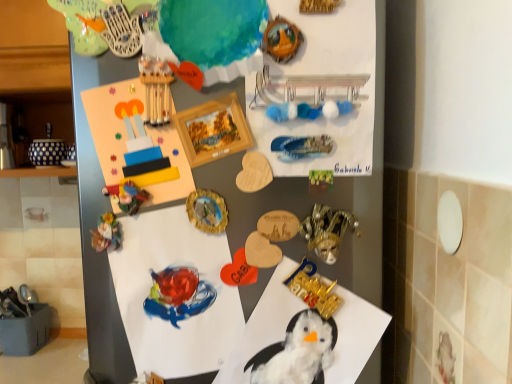
You are a GUI agent. You are given a task and a screenshot of the screen. Output one action in this format:
    pyautogui.click(x=<x>, y=<y>)
    Task: Click on the white matte paper at upper center, which is the 1th paper in top-to-bottom order
    Image resolution: width=512 pixels, height=384 pixels.
    Given the screenshot: What is the action you would take?
    pyautogui.click(x=319, y=92)

What is the approximate width of white fluffy paper at center, which appears as the third paper when viewed from the top?

2.17 inches.

Describe the element at coordinates (106, 233) in the screenshot. I see `porcelain figurine at lower left, which is counted as the second art, starting from the top` at that location.

Image resolution: width=512 pixels, height=384 pixels. What do you see at coordinates (313, 289) in the screenshot?
I see `gold metallic mask at center, which ranks as the first toy in bottom-to-top order` at bounding box center [313, 289].

What are the coordinates of `white matte paper at upper center, which is the 1th paper in top-to-bottom order` in the screenshot? It's located at (319, 92).

Does white fluffy paper at center, which appears as the first paper when ordered from the bottom, have a greater height compared to watercolor paper at center, the 2th paper viewed from the top?

Correct, white fluffy paper at center, which appears as the first paper when ordered from the bottom, is much taller as watercolor paper at center, the 2th paper viewed from the top.

In order to click on the 1st paper to the right of the watercolor paper at center, placed as the second paper when sorted from bottom to top, starting your count from the anchor in this screenshot , I will do [265, 327].

Looking at this image, is white fluffy paper at center, which appears as the first paper when ordered from the bottom, in front of or behind watercolor paper at center, the 2th paper viewed from the top, in the image?

white fluffy paper at center, which appears as the first paper when ordered from the bottom, is positioned closer to the viewer than watercolor paper at center, the 2th paper viewed from the top.

Does gold metallic mask at center, which ranks as the first toy in bottom-to-top order, have a smaller size compared to wooden picture frame at center?

Correct, gold metallic mask at center, which ranks as the first toy in bottom-to-top order, occupies less space than wooden picture frame at center.

Considering the relative positions of gold metallic mask at center, placed as the 2th toy when sorted from top to bottom, and wooden picture frame at center in the image provided, is gold metallic mask at center, placed as the 2th toy when sorted from top to bottom, to the right of wooden picture frame at center from the viewer's perspective?

Yes.

Is gold metallic mask at center, which ranks as the first toy in bottom-to-top order, closer to camera compared to wooden picture frame at center?

No, gold metallic mask at center, which ranks as the first toy in bottom-to-top order, is further to the viewer.

Is gold metallic mask at center, placed as the 2th toy when sorted from top to bottom, positioned with its back to wooden picture frame at center?

gold metallic mask at center, placed as the 2th toy when sorted from top to bottom, is not turned away from wooden picture frame at center.

Is wooden picture frame at center surrounded by watercolor paper at center, the 2th paper viewed from the top?

No, wooden picture frame at center is located outside of watercolor paper at center, the 2th paper viewed from the top.

At what (x,y) coordinates should I click in order to perform the action: click on paper on the left of wooden picture frame at center. Please return your answer as a coordinate pair (x, y). The height and width of the screenshot is (384, 512). Looking at the image, I should click on (170, 304).

Can you confirm if watercolor paper at center, placed as the second paper when sorted from bottom to top, is shorter than wooden picture frame at center?

In fact, watercolor paper at center, placed as the second paper when sorted from bottom to top, may be taller than wooden picture frame at center.

From the image's perspective, does gold metallic mask at center, placed as the 2th toy when sorted from top to bottom, appear lower than porcelain figurine at lower left, which is counted as the second art, starting from the top?

Yes, from the image's perspective, gold metallic mask at center, placed as the 2th toy when sorted from top to bottom, is beneath porcelain figurine at lower left, which is counted as the second art, starting from the top.

Is gold metallic mask at center, placed as the 2th toy when sorted from top to bottom, not inside porcelain figurine at lower left, arranged as the first art when ordered from the bottom?

Indeed, gold metallic mask at center, placed as the 2th toy when sorted from top to bottom, is completely outside porcelain figurine at lower left, arranged as the first art when ordered from the bottom.

Considering their positions, is gold metallic mask at center, placed as the 2th toy when sorted from top to bottom, located in front of or behind porcelain figurine at lower left, which is counted as the second art, starting from the top?

gold metallic mask at center, placed as the 2th toy when sorted from top to bottom, is positioned closer to the viewer than porcelain figurine at lower left, which is counted as the second art, starting from the top.

Who is smaller, white matte paper at upper center, positioned as the 3th paper in bottom-to-top order, or gold metallic mask at center-right, the first toy in the top-to-bottom sequence?

Smaller between the two is gold metallic mask at center-right, the first toy in the top-to-bottom sequence.

Would you say white matte paper at upper center, which is the 1th paper in top-to-bottom order, is inside or outside gold metallic mask at center-right, the second toy in the bottom-to-top sequence?

white matte paper at upper center, which is the 1th paper in top-to-bottom order, lies outside gold metallic mask at center-right, the second toy in the bottom-to-top sequence.

In the scene shown: Is white matte paper at upper center, which is the 1th paper in top-to-bottom order, thinner than gold metallic mask at center-right, the second toy in the bottom-to-top sequence?

Yes, white matte paper at upper center, which is the 1th paper in top-to-bottom order, is thinner than gold metallic mask at center-right, the second toy in the bottom-to-top sequence.

Is white matte paper at upper center, positioned as the 3th paper in bottom-to-top order, turned away from wooden picture frame at center?

No.

Is point (338, 55) behind point (228, 112)?

No, (338, 55) is in front of (228, 112).

Considering their positions, is white matte paper at upper center, positioned as the 3th paper in bottom-to-top order, located in front of or behind wooden picture frame at center?

Clearly, white matte paper at upper center, positioned as the 3th paper in bottom-to-top order, is behind wooden picture frame at center.

Considering the sizes of objects white matte paper at upper center, which is the 1th paper in top-to-bottom order, and wooden picture frame at center in the image provided, who is taller, white matte paper at upper center, which is the 1th paper in top-to-bottom order, or wooden picture frame at center?

white matte paper at upper center, which is the 1th paper in top-to-bottom order.

Is gold metallic mask at center-right, the first toy in the top-to-bottom sequence, to the right of white matte paper at upper center, positioned as the 3th paper in bottom-to-top order, from the viewer's perspective?

Correct, you'll find gold metallic mask at center-right, the first toy in the top-to-bottom sequence, to the right of white matte paper at upper center, positioned as the 3th paper in bottom-to-top order.

Starting from the white matte paper at upper center, positioned as the 3th paper in bottom-to-top order, which toy is the 1st one behind? Please provide its 2D coordinates.

[(327, 231)]

Looking at this image, which object is further away from the camera, gold metallic mask at center-right, the first toy in the top-to-bottom sequence, or white matte paper at upper center, positioned as the 3th paper in bottom-to-top order?

gold metallic mask at center-right, the first toy in the top-to-bottom sequence, is more distant.

Is white matte paper at upper center, positioned as the 3th paper in bottom-to-top order, surrounded by gold metallic mask at center-right, the first toy in the top-to-bottom sequence?

No, white matte paper at upper center, positioned as the 3th paper in bottom-to-top order, is not inside gold metallic mask at center-right, the first toy in the top-to-bottom sequence.

This screenshot has width=512, height=384. I want to click on the 2nd paper in front of the watercolor paper at center, the 2th paper viewed from the top, so click(x=265, y=327).

What are the coordinates of `the 1st toy to the right of the wooden picture frame at center, starting your count from the anchor` in the screenshot? It's located at (313, 289).

Looking at the image, which one is located closer to white fluffy paper at center, which appears as the third paper when viewed from the top, wooden picture frame at center or wooden postcard at upper center?

wooden picture frame at center lies closer to white fluffy paper at center, which appears as the third paper when viewed from the top, than the other object.

Which object lies further to the anchor point watercolor paper at center, the 2th paper viewed from the top, wooden picture frame at center or gold metallic mask at center, which ranks as the first toy in bottom-to-top order?

wooden picture frame at center.

Which object lies further to the anchor point gold metallic mask at center, placed as the 2th toy when sorted from top to bottom, watercolor paper at center, the 2th paper viewed from the top, or white matte paper at upper center, which is the 1th paper in top-to-bottom order?

white matte paper at upper center, which is the 1th paper in top-to-bottom order, is further to gold metallic mask at center, placed as the 2th toy when sorted from top to bottom.

Considering their positions, is matte plastic toy at center-left, which ranks as the 2th art in bottom-to-top order, positioned closer to gold metallic mask at center, which ranks as the first toy in bottom-to-top order, than gold metallic mask at center-right, the first toy in the top-to-bottom sequence?

Among the two, gold metallic mask at center-right, the first toy in the top-to-bottom sequence, is located nearer to gold metallic mask at center, which ranks as the first toy in bottom-to-top order.

From the image, which object appears to be farther from wooden picture frame at center, white fluffy paper at center, which appears as the first paper when ordered from the bottom, or white matte paper at upper center, positioned as the 3th paper in bottom-to-top order?

white fluffy paper at center, which appears as the first paper when ordered from the bottom.

Based on their spatial positions, is wooden postcard at upper center or watercolor paper at center, the 2th paper viewed from the top, further from wooden picture frame at center?

Among the two, watercolor paper at center, the 2th paper viewed from the top, is located further to wooden picture frame at center.

Looking at the image, which one is located further to wooden postcard at upper center, porcelain figurine at lower left, which is counted as the second art, starting from the top, or gold metallic mask at center-right, the second toy in the bottom-to-top sequence?

gold metallic mask at center-right, the second toy in the bottom-to-top sequence, lies further to wooden postcard at upper center than the other object.

Which object lies nearer to the anchor point watercolor paper at center, placed as the second paper when sorted from bottom to top, white matte paper at upper center, positioned as the 3th paper in bottom-to-top order, or gold metallic mask at center-right, the second toy in the bottom-to-top sequence?

gold metallic mask at center-right, the second toy in the bottom-to-top sequence, lies closer to watercolor paper at center, placed as the second paper when sorted from bottom to top, than the other object.

The width and height of the screenshot is (512, 384). What are the coordinates of `postcard that lies between white matte paper at upper center, positioned as the 3th paper in bottom-to-top order, and gold metallic mask at center, which ranks as the first toy in bottom-to-top order, from top to bottom` in the screenshot? It's located at (112, 122).

Where is `paper between wooden picture frame at center and white fluffy paper at center, which appears as the third paper when viewed from the top, in the up-down direction`? paper between wooden picture frame at center and white fluffy paper at center, which appears as the third paper when viewed from the top, in the up-down direction is located at coordinates (170, 304).

Locate an element on the screen. paper between white matte paper at upper center, positioned as the 3th paper in bottom-to-top order, and white fluffy paper at center, which appears as the third paper when viewed from the top, vertically is located at coordinates (170, 304).

In order to click on art between matte plastic toy at center-left, which ranks as the 2th art in bottom-to-top order, and watercolor paper at center, the 2th paper viewed from the top, from top to bottom in this screenshot , I will do `click(106, 233)`.